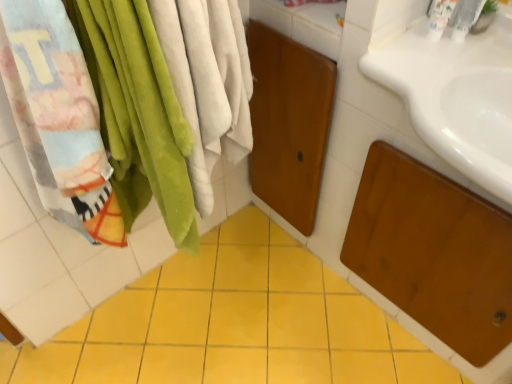
The width and height of the screenshot is (512, 384). Identify the location of white plastic bottle at upper right, the first toiletry when ordered from left to right. [439, 17].

Does white plastic faucet at upper right, placed as the 2th toiletry when sorted from left to right, appear on the left side of yellow ceramic tile at center?

No.

Is white plastic faucet at upper right, the first toiletry positioned from the right, shorter than yellow ceramic tile at center?

No, white plastic faucet at upper right, the first toiletry positioned from the right, is not shorter than yellow ceramic tile at center.

Is white plastic faucet at upper right, placed as the 2th toiletry when sorted from left to right, smaller than yellow ceramic tile at center?

Yes, white plastic faucet at upper right, placed as the 2th toiletry when sorted from left to right, is smaller than yellow ceramic tile at center.

Is white plastic faucet at upper right, the first toiletry positioned from the right, located outside yellow ceramic tile at center?

Yes, white plastic faucet at upper right, the first toiletry positioned from the right, is outside of yellow ceramic tile at center.

Is yellow ceramic tile at center outside of white plastic bottle at upper right, positioned as the second toiletry in right-to-left order?

Yes.

From a real-world perspective, between yellow ceramic tile at center and white plastic bottle at upper right, the first toiletry when ordered from left to right, who is vertically lower?

yellow ceramic tile at center, from a real-world perspective.

You are a GUI agent. You are given a task and a screenshot of the screen. Output one action in this format:
    pyautogui.click(x=<x>, y=<y>)
    Task: Click on the toiletry that is the 1st one above the yellow ceramic tile at center (from a real-world perspective)
    The height and width of the screenshot is (384, 512).
    Given the screenshot: What is the action you would take?
    pyautogui.click(x=439, y=17)

How many degrees apart are the facing directions of yellow ceramic tile at center and white plastic bottle at upper right, positioned as the second toiletry in right-to-left order?

The angle between the facing direction of yellow ceramic tile at center and the facing direction of white plastic bottle at upper right, positioned as the second toiletry in right-to-left order, is 90.8 degrees.

Between white plastic faucet at upper right, the first toiletry positioned from the right, and white plastic bottle at upper right, positioned as the second toiletry in right-to-left order, which one appears on the right side from the viewer's perspective?

white plastic faucet at upper right, the first toiletry positioned from the right.

Which of these two, white plastic faucet at upper right, the first toiletry positioned from the right, or white plastic bottle at upper right, the first toiletry when ordered from left to right, is smaller?

With smaller size is white plastic faucet at upper right, the first toiletry positioned from the right.

In the scene shown: Considering the relative sizes of white plastic faucet at upper right, placed as the 2th toiletry when sorted from left to right, and white plastic bottle at upper right, positioned as the second toiletry in right-to-left order, in the image provided, is white plastic faucet at upper right, placed as the 2th toiletry when sorted from left to right, thinner than white plastic bottle at upper right, positioned as the second toiletry in right-to-left order,?

Yes.

Is the surface of white plastic faucet at upper right, the first toiletry positioned from the right, in direct contact with white plastic bottle at upper right, the first toiletry when ordered from left to right?

Yes, white plastic faucet at upper right, the first toiletry positioned from the right, is in contact with white plastic bottle at upper right, the first toiletry when ordered from left to right.

Is white plastic faucet at upper right, placed as the 2th toiletry when sorted from left to right, a part of yellow ceramic tile at center?

No, white plastic faucet at upper right, placed as the 2th toiletry when sorted from left to right, is not inside yellow ceramic tile at center.

Does yellow ceramic tile at center appear on the right side of white plastic faucet at upper right, the first toiletry positioned from the right?

Incorrect, yellow ceramic tile at center is not on the right side of white plastic faucet at upper right, the first toiletry positioned from the right.

Considering the sizes of yellow ceramic tile at center and white plastic faucet at upper right, placed as the 2th toiletry when sorted from left to right, in the image, is yellow ceramic tile at center taller or shorter than white plastic faucet at upper right, placed as the 2th toiletry when sorted from left to right,?

In the image, yellow ceramic tile at center appears to be shorter than white plastic faucet at upper right, placed as the 2th toiletry when sorted from left to right.

Which of these two, yellow ceramic tile at center or white plastic faucet at upper right, placed as the 2th toiletry when sorted from left to right, is smaller?

With smaller size is white plastic faucet at upper right, placed as the 2th toiletry when sorted from left to right.

Which is in front, point (441, 18) or point (219, 248)?

Point (441, 18)

In the image, is white plastic bottle at upper right, the first toiletry when ordered from left to right, positioned in front of or behind yellow ceramic tile at center?

white plastic bottle at upper right, the first toiletry when ordered from left to right, is positioned farther from the viewer than yellow ceramic tile at center.

Could yellow ceramic tile at center be considered to be inside white plastic bottle at upper right, the first toiletry when ordered from left to right?

No, yellow ceramic tile at center is not surrounded by white plastic bottle at upper right, the first toiletry when ordered from left to right.

Locate an element on the screen. The image size is (512, 384). toiletry lying on the right of white plastic bottle at upper right, the first toiletry when ordered from left to right is located at coordinates (464, 19).

From a real-world perspective, is white plastic bottle at upper right, positioned as the second toiletry in right-to-left order, positioned above or below white plastic faucet at upper right, placed as the 2th toiletry when sorted from left to right?

white plastic bottle at upper right, positioned as the second toiletry in right-to-left order, is situated lower than white plastic faucet at upper right, placed as the 2th toiletry when sorted from left to right, in the real world.

Is white plastic bottle at upper right, positioned as the second toiletry in right-to-left order, positioned with its back to white plastic faucet at upper right, the first toiletry positioned from the right?

white plastic bottle at upper right, positioned as the second toiletry in right-to-left order, does not have its back to white plastic faucet at upper right, the first toiletry positioned from the right.

You are a GUI agent. You are given a task and a screenshot of the screen. Output one action in this format:
    pyautogui.click(x=<x>, y=<y>)
    Task: Click on the 1st toiletry behind the yellow ceramic tile at center
    This screenshot has width=512, height=384.
    Given the screenshot: What is the action you would take?
    pyautogui.click(x=464, y=19)

Starting from the yellow ceramic tile at center, which toiletry is the 1st one to the right? Please provide its 2D coordinates.

[(439, 17)]

Which object lies further to the anchor point white plastic bottle at upper right, the first toiletry when ordered from left to right, yellow ceramic tile at center or white plastic faucet at upper right, the first toiletry positioned from the right?

Among the two, yellow ceramic tile at center is located further to white plastic bottle at upper right, the first toiletry when ordered from left to right.

Estimate the real-world distances between objects in this image. Which object is closer to yellow ceramic tile at center, white plastic bottle at upper right, positioned as the second toiletry in right-to-left order, or white plastic faucet at upper right, placed as the 2th toiletry when sorted from left to right?

Based on the image, white plastic bottle at upper right, positioned as the second toiletry in right-to-left order, appears to be nearer to yellow ceramic tile at center.

Considering their positions, is white plastic faucet at upper right, placed as the 2th toiletry when sorted from left to right, positioned closer to white plastic bottle at upper right, positioned as the second toiletry in right-to-left order, than yellow ceramic tile at center?

white plastic faucet at upper right, placed as the 2th toiletry when sorted from left to right, is closer to white plastic bottle at upper right, positioned as the second toiletry in right-to-left order.

When comparing their distances from white plastic faucet at upper right, the first toiletry positioned from the right, does yellow ceramic tile at center or white plastic bottle at upper right, positioned as the second toiletry in right-to-left order, seem closer?

white plastic bottle at upper right, positioned as the second toiletry in right-to-left order, is positioned closer to the anchor white plastic faucet at upper right, the first toiletry positioned from the right.

When comparing their distances from white plastic faucet at upper right, the first toiletry positioned from the right, does white plastic bottle at upper right, positioned as the second toiletry in right-to-left order, or yellow ceramic tile at center seem further?

Among the two, yellow ceramic tile at center is located further to white plastic faucet at upper right, the first toiletry positioned from the right.

Which object lies further to the anchor point yellow ceramic tile at center, white plastic faucet at upper right, the first toiletry positioned from the right, or white plastic bottle at upper right, the first toiletry when ordered from left to right?

white plastic faucet at upper right, the first toiletry positioned from the right, is positioned further to the anchor yellow ceramic tile at center.

Where is `toiletry between white plastic bottle at upper right, positioned as the second toiletry in right-to-left order, and yellow ceramic tile at center, in the vertical direction`? toiletry between white plastic bottle at upper right, positioned as the second toiletry in right-to-left order, and yellow ceramic tile at center, in the vertical direction is located at coordinates (464, 19).